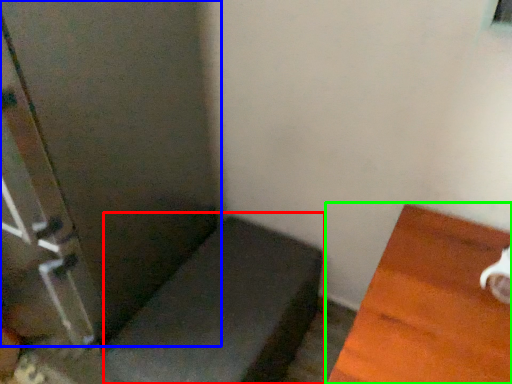
Question: Which is nearer to the furniture (highlighted by a red box)? screen door (highlighted by a blue box) or furniture (highlighted by a green box).

Choices:
 (A) screen door
 (B) furniture

Answer: (A)